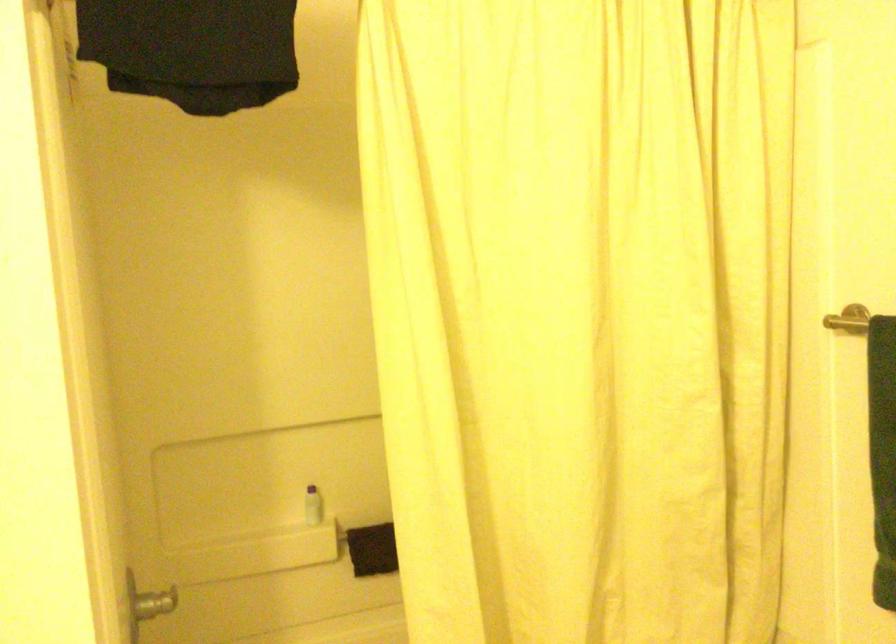
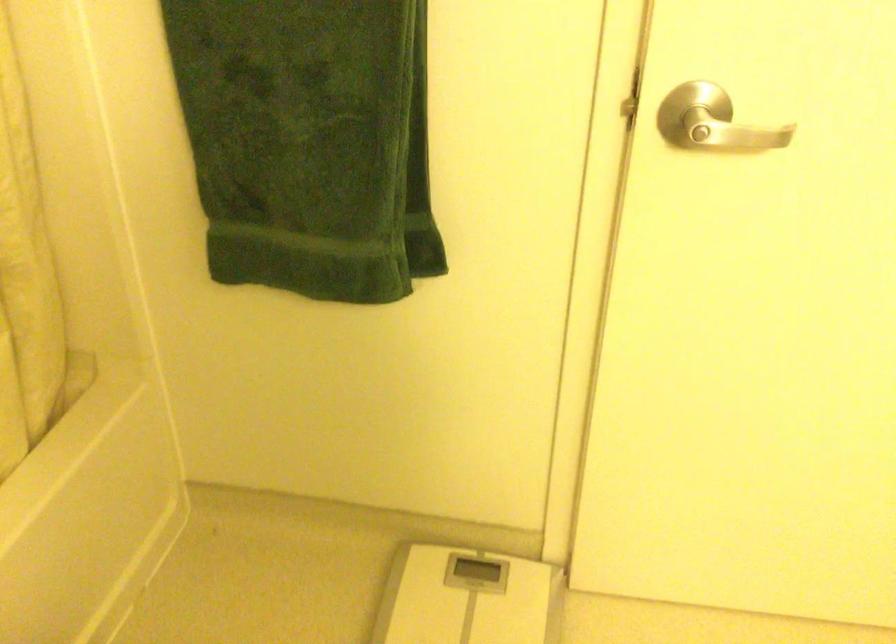
The images are taken continuously from a first-person perspective. In which direction is your viewpoint rotating?

The rotation direction of the camera is right-down.